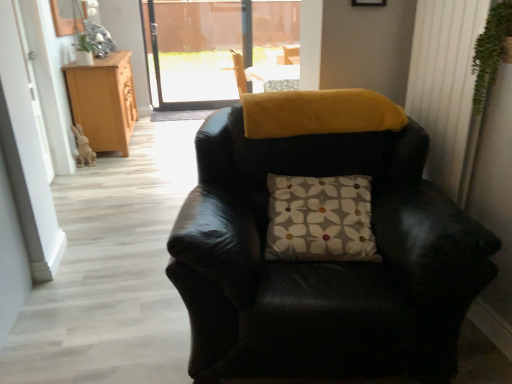
Identify the location of black leather chair at center. (324, 262).

This screenshot has width=512, height=384. Describe the element at coordinates (104, 101) in the screenshot. I see `light brown wood cabinet at left` at that location.

This screenshot has width=512, height=384. I want to click on green leafy plant at upper right, so click(x=490, y=51).

Is black leather chair at center far from green leafy plant at upper right?

Actually, black leather chair at center and green leafy plant at upper right are a little close together.

In terms of height, does black leather chair at center look taller or shorter compared to green leafy plant at upper right?

In the image, black leather chair at center appears to be taller than green leafy plant at upper right.

From a real-world perspective, between black leather chair at center and green leafy plant at upper right, who is vertically lower?

black leather chair at center, from a real-world perspective.

Is floral-patterned fabric pillow at center outside of black leather chair at center?

No, most part of floral-patterned fabric pillow at center lies within black leather chair at center.

Is point (270, 205) closer to viewer compared to point (362, 299)?

No, (270, 205) is behind (362, 299).

In the image, is floral-patterned fabric pillow at center on the left side or the right side of black leather chair at center?

Based on their positions, floral-patterned fabric pillow at center is located to the right of black leather chair at center.

Is white textured curtain at right smaller than floral-patterned fabric pillow at center?

Yes.

From a real-world perspective, which object rests below the other?

floral-patterned fabric pillow at center, from a real-world perspective.

Consider the image. From the image's perspective, which one is positioned higher, white textured curtain at right or floral-patterned fabric pillow at center?

white textured curtain at right, from the image's perspective.

From a real-world perspective, is white textured curtain at right located higher than light brown wood cabinet at left?

Yes, from a real-world perspective, white textured curtain at right is on top of light brown wood cabinet at left.

Which of these two, white textured curtain at right or light brown wood cabinet at left, is bigger?

light brown wood cabinet at left.

Consider the image. Visually, is white textured curtain at right positioned to the left or to the right of light brown wood cabinet at left?

From the image, it's evident that white textured curtain at right is to the right of light brown wood cabinet at left.

Would you say light brown wood cabinet at left is outside floral-patterned fabric pillow at center?

Yes, light brown wood cabinet at left is not within floral-patterned fabric pillow at center.

Considering the relative sizes of light brown wood cabinet at left and floral-patterned fabric pillow at center in the image provided, is light brown wood cabinet at left taller than floral-patterned fabric pillow at center?

Yes.

Is point (84, 100) more distant than point (336, 177)?

Yes, point (84, 100) is behind point (336, 177).

Is green leafy plant at upper right smaller than light brown wood cabinet at left?

Yes.

Does green leafy plant at upper right lie in front of light brown wood cabinet at left?

Yes, it is.

From their relative heights in the image, would you say green leafy plant at upper right is taller or shorter than light brown wood cabinet at left?

green leafy plant at upper right is shorter than light brown wood cabinet at left.

Consider the image. Is green leafy plant at upper right located outside light brown wood cabinet at left?

Yes, green leafy plant at upper right is not within light brown wood cabinet at left.

Is black leather chair at center oriented towards white textured curtain at right?

No, black leather chair at center does not turn towards white textured curtain at right.

How far apart are black leather chair at center and white textured curtain at right?

23.08 inches.

Is white textured curtain at right completely or partially inside black leather chair at center?

Definitely not — white textured curtain at right is not inside black leather chair at center.

What's the angular difference between black leather chair at center and white textured curtain at right's facing directions?

There is a 76.5-degree angle between the facing directions of black leather chair at center and white textured curtain at right.

The height and width of the screenshot is (384, 512). I want to click on plant above the black leather chair at center (from a real-world perspective), so click(x=490, y=51).

This screenshot has width=512, height=384. Identify the location of chair lying in front of the floral-patterned fabric pillow at center. coord(324,262).

Estimate the real-world distances between objects in this image. Which object is further from green leafy plant at upper right, white textured curtain at right or light brown wood cabinet at left?

light brown wood cabinet at left is further to green leafy plant at upper right.

Based on their spatial positions, is floral-patterned fabric pillow at center or green leafy plant at upper right closer to black leather chair at center?

Among the two, floral-patterned fabric pillow at center is located nearer to black leather chair at center.

Looking at the image, which one is located closer to floral-patterned fabric pillow at center, white textured curtain at right or black leather chair at center?

Answer: black leather chair at center lies closer to floral-patterned fabric pillow at center than the other object.

Based on their spatial positions, is white textured curtain at right or green leafy plant at upper right closer to floral-patterned fabric pillow at center?

white textured curtain at right is closer to floral-patterned fabric pillow at center.

Looking at the image, which one is located further to floral-patterned fabric pillow at center, black leather chair at center or light brown wood cabinet at left?

light brown wood cabinet at left is positioned further to the anchor floral-patterned fabric pillow at center.

Estimate the real-world distances between objects in this image. Which object is closer to black leather chair at center, green leafy plant at upper right or white textured curtain at right?

Among the two, white textured curtain at right is located nearer to black leather chair at center.

In the scene shown: When comparing their distances from green leafy plant at upper right, does light brown wood cabinet at left or white textured curtain at right seem further?

light brown wood cabinet at left.

Estimate the real-world distances between objects in this image. Which object is further from white textured curtain at right, light brown wood cabinet at left or black leather chair at center?

light brown wood cabinet at left lies further to white textured curtain at right than the other object.

Locate an element on the screen. The height and width of the screenshot is (384, 512). plant between light brown wood cabinet at left and white textured curtain at right from left to right is located at coordinates (490, 51).

The height and width of the screenshot is (384, 512). In order to click on pillow between green leafy plant at upper right and light brown wood cabinet at left in the front-back direction in this screenshot , I will do `click(320, 219)`.

This screenshot has width=512, height=384. Identify the location of pillow between black leather chair at center and white textured curtain at right in the horizontal direction. (320, 219).

Find the location of a particular element. The image size is (512, 384). curtain positioned between black leather chair at center and light brown wood cabinet at left from near to far is located at coordinates (446, 87).